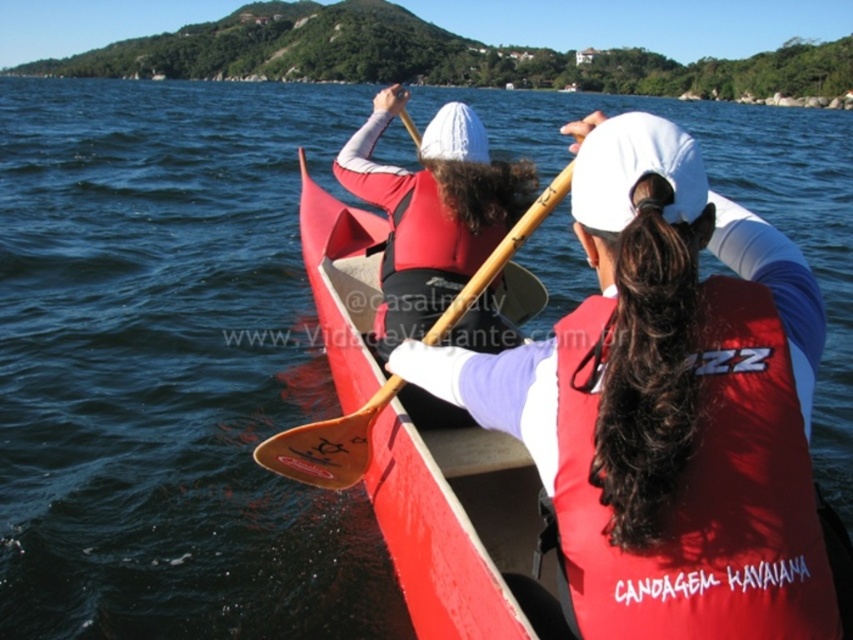
You are standing on the shore of the lake and see the point marked at coordinates point (755,388) in the image. You want to throw a lifebuoy to the people in the red canoe. Is the lifebuoy likely to reach the people if you aim for that point?

The distance of point (755,388) from viewer is 14.45 feet. The lifebuoy can reach that distance, so yes, aiming for that point would likely reach the people in the red canoe.

You are standing on a dock and see the red matte life jacket at center floating in the water. If you want to reach it with a 3.5 meter long pole, will you be able to? Please explain your reasoning.

The red matte life jacket at center is 4.15 meters away from the camera. Since the pole is only 3.5 meters long, it is not long enough to reach the life jacket.